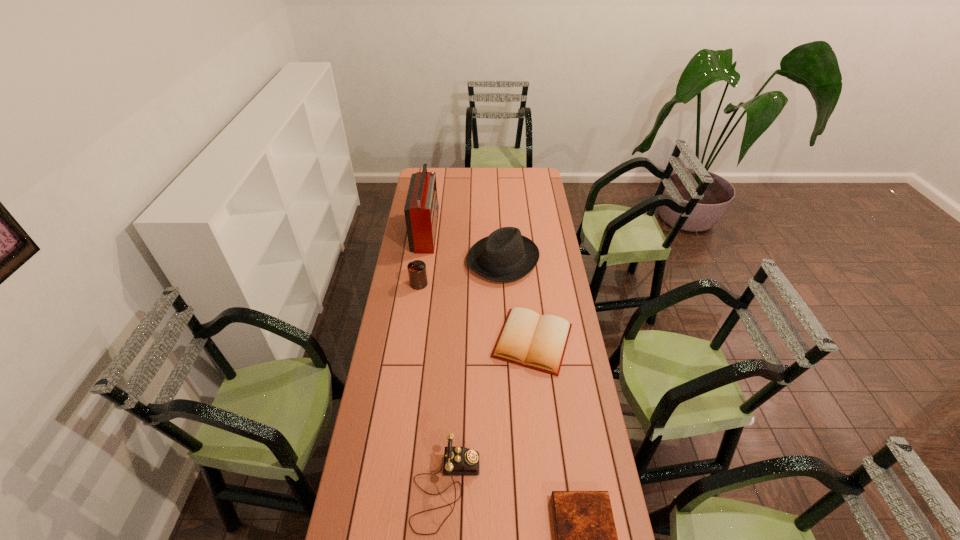
This screenshot has width=960, height=540. Find the location of `radio receiver`. radio receiver is located at coordinates (421, 208).

Locate an element on the screen. Image resolution: width=960 pixels, height=540 pixels. fedora is located at coordinates (505, 255).

Locate an element on the screen. This screenshot has height=540, width=960. can is located at coordinates (417, 273).

This screenshot has height=540, width=960. In order to click on the third shortest object in this screenshot , I will do click(457, 460).

Identify the location of the farther Bible. This screenshot has height=540, width=960. (538, 342).

Where is `the fifth tallest object`? This screenshot has height=540, width=960. the fifth tallest object is located at coordinates (538, 342).

The height and width of the screenshot is (540, 960). I want to click on free space located 0.200m on the front-facing side of the tallest object, so click(x=476, y=232).

In order to click on free point located on the left of the fedora in this screenshot , I will do `click(438, 260)`.

Identify the location of free region located 0.130m on the back of the can. Image resolution: width=960 pixels, height=540 pixels. (422, 260).

In order to click on vacant area situated 0.130m on the dial of the third shortest object in this screenshot , I will do `click(521, 488)`.